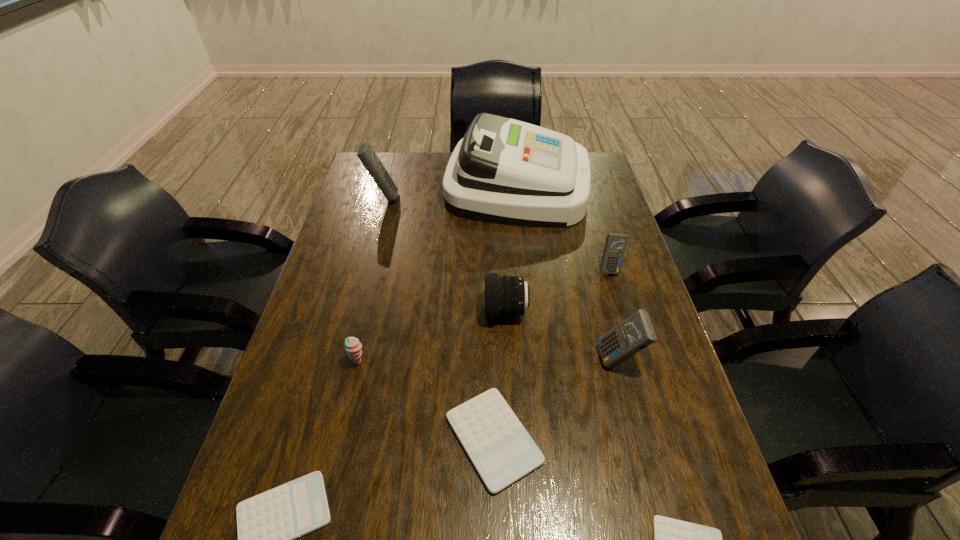
I want to click on free point located on the front-facing side of the fifth nearest calculator, so (x=626, y=324).

This screenshot has width=960, height=540. I want to click on vacant space located on the back of the fourth shortest object, so click(379, 272).

I want to click on vacant space located on the right of the fourth tallest calculator, so tap(637, 438).

Find the location of a particular element. object located at the far edge is located at coordinates (504, 171).

Locate an element on the screen. The height and width of the screenshot is (540, 960). calculator that is at the left edge is located at coordinates (366, 154).

Identify the location of sherbert present at the left edge. (353, 347).

This screenshot has width=960, height=540. What are the coordinates of `cash register that is at the right edge` in the screenshot? It's located at (504, 171).

The width and height of the screenshot is (960, 540). I want to click on object that is at the far right corner, so click(504, 171).

Find the location of a particular element. Image resolution: width=960 pixels, height=540 pixels. free region at the far edge of the desktop is located at coordinates (430, 163).

The width and height of the screenshot is (960, 540). Identify the location of free space at the left edge of the desktop. (365, 275).